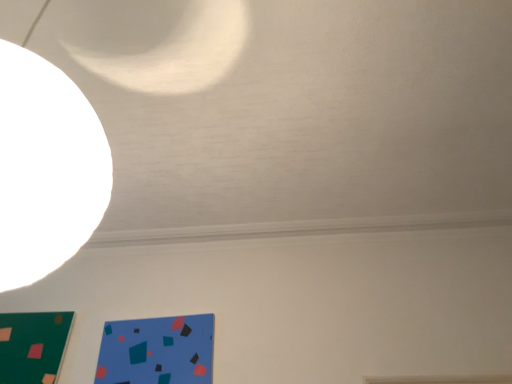
Question: Based on their positions, is green matte board at lower left located to the left or right of blue matte paper at lower left?

Choices:
 (A) right
 (B) left

Answer: (B)

Question: In terms of width, does green matte board at lower left look wider or thinner when compared to blue matte paper at lower left?

Choices:
 (A) wide
 (B) thin

Answer: (A)

Question: Is point (18, 339) closer or farther from the camera than point (155, 374)?

Choices:
 (A) closer
 (B) farther

Answer: (B)

Question: Is point (168, 354) closer or farther from the camera than point (56, 369)?

Choices:
 (A) farther
 (B) closer

Answer: (B)

Question: From their relative heights in the image, would you say blue matte paper at lower left is taller or shorter than green matte board at lower left?

Choices:
 (A) short
 (B) tall

Answer: (A)

Question: From a real-world perspective, is blue matte paper at lower left positioned above or below green matte board at lower left?

Choices:
 (A) below
 (B) above

Answer: (A)

Question: From the image's perspective, is blue matte paper at lower left above or below green matte board at lower left?

Choices:
 (A) above
 (B) below

Answer: (A)